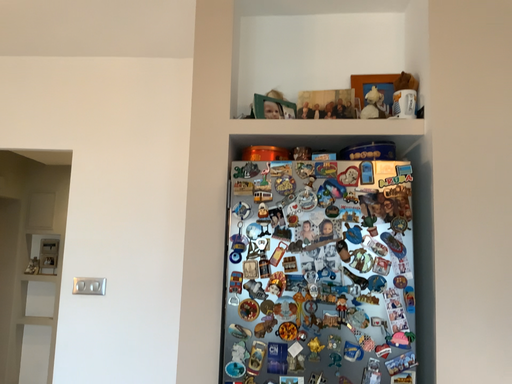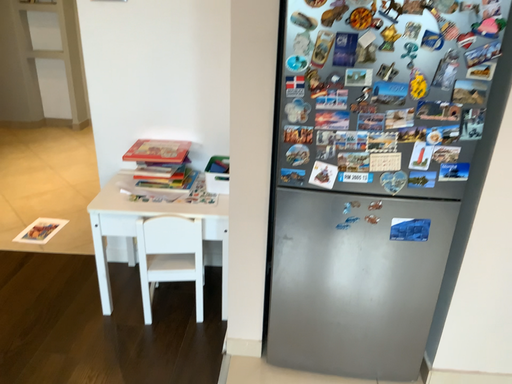
Question: How did the camera likely rotate when shooting the video?

Choices:
 (A) rotated downward
 (B) rotated upward

Answer: (A)